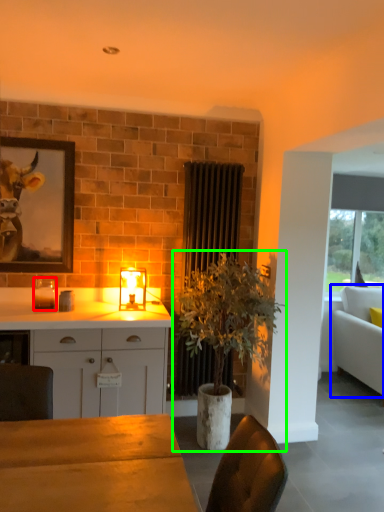
Question: Which object is the farthest from candle holder (highlighted by a red box)? Choose among these: studio couch (highlighted by a blue box) or houseplant (highlighted by a green box).

Choices:
 (A) studio couch
 (B) houseplant

Answer: (A)